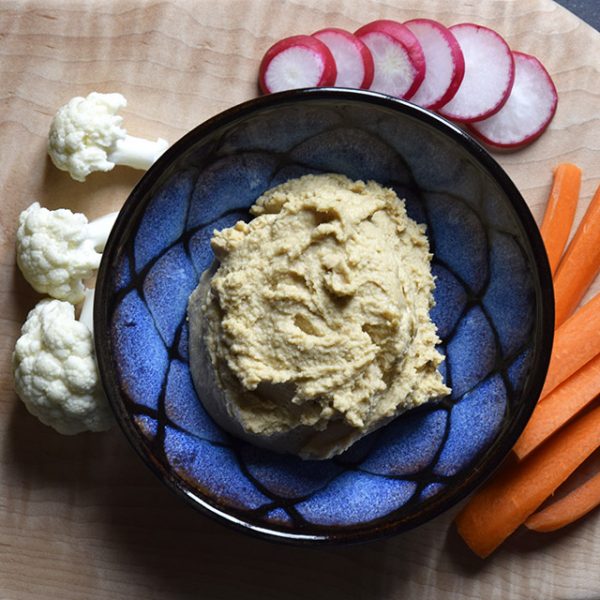
You are a GUI agent. You are given a task and a screenshot of the screen. Output one action in this format:
    pyautogui.click(x=<x>, y=<y>)
    Task: Click on the rim of bowl
    The height and width of the screenshot is (600, 600).
    Given the screenshot: What is the action you would take?
    pyautogui.click(x=103, y=337), pyautogui.click(x=360, y=536), pyautogui.click(x=543, y=284), pyautogui.click(x=285, y=95)